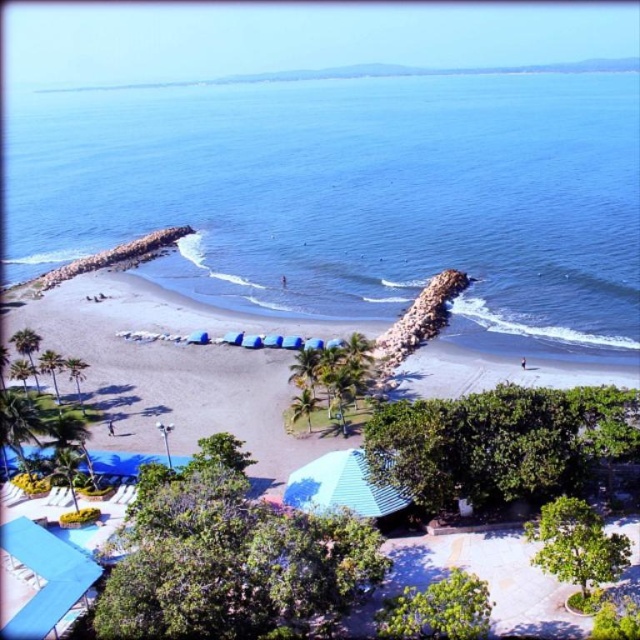
You are standing on the beach and see two points marked in the scene. The first point is at coordinates point (500, 291) and the second is at point (602, 376). Which point is closer to you?

Point (500, 291) is further to the camera than point (602, 376), so the point closer to you is point (602, 376).

You are standing on the beach and want to take a photo of both the blue water at center and the brown sandy beach at center. Which object will appear closer to the camera in your photo?

The blue water at center will appear closer to the camera in the photo because it is further to the viewer than the brown sandy beach at center, meaning it is positioned nearer to the observer.